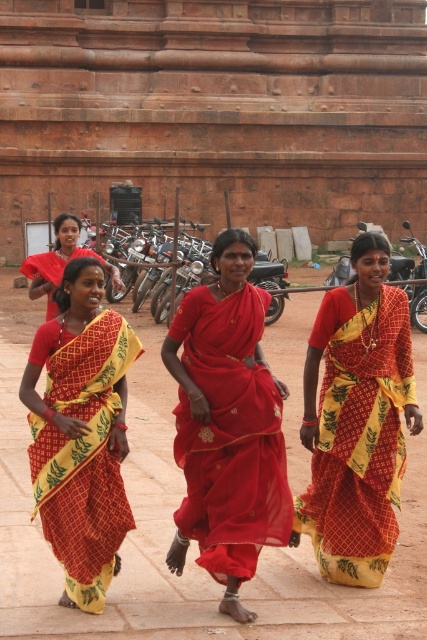
Question: Is yellow printed sari at center to the left of red/yellow printed sari at center from the viewer's perspective?

Choices:
 (A) no
 (B) yes

Answer: (A)

Question: Where is yellow printed sari at center located in relation to red silk saree at center in the image?

Choices:
 (A) above
 (B) below

Answer: (B)

Question: Which object is the farthest from the red silk saree at center?

Choices:
 (A) matte red sari at center
 (B) yellow printed sari at center

Answer: (A)

Question: Which object is closer to the camera taking this photo?

Choices:
 (A) matte red sari at center
 (B) red silk saree at center
 (C) yellow printed sari at center

Answer: (A)

Question: Which point is closer to the camera taking this photo?

Choices:
 (A) (183, 380)
 (B) (35, 292)

Answer: (A)

Question: Does yellow printed sari at center have a smaller size compared to red/yellow printed sari at center?

Choices:
 (A) yes
 (B) no

Answer: (A)